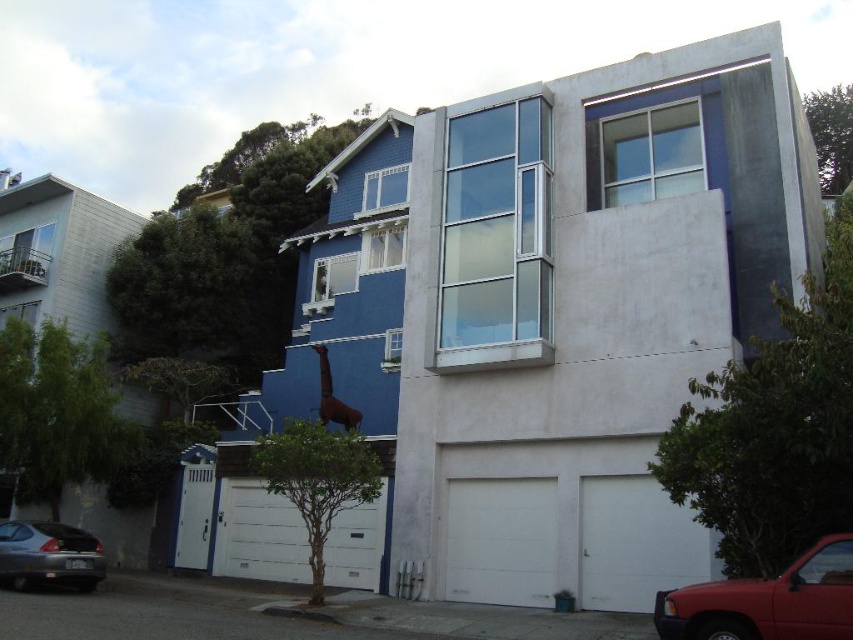
Question: Does white matte/glossy garage door at center appear on the right side of green leafy tree at lower left?

Choices:
 (A) no
 (B) yes

Answer: (B)

Question: Which object appears farthest from the camera in this image?

Choices:
 (A) shiny red truck at lower right
 (B) green leafy tree at lower left

Answer: (B)

Question: Can you confirm if metallic gray sedan at lower left is positioned above green leafy tree at upper right?

Choices:
 (A) yes
 (B) no

Answer: (B)

Question: Based on their relative distances, which object is nearer to the green leafy tree at right?

Choices:
 (A) shiny red truck at lower right
 (B) white matte/glossy garage door at center
 (C) green leafy tree at lower left

Answer: (A)

Question: Which point is farther from the camera taking this photo?

Choices:
 (A) (80, 561)
 (B) (720, 536)

Answer: (A)

Question: Can you confirm if green leafy tree at right is wider than white matte/glossy garage door at center?

Choices:
 (A) no
 (B) yes

Answer: (A)